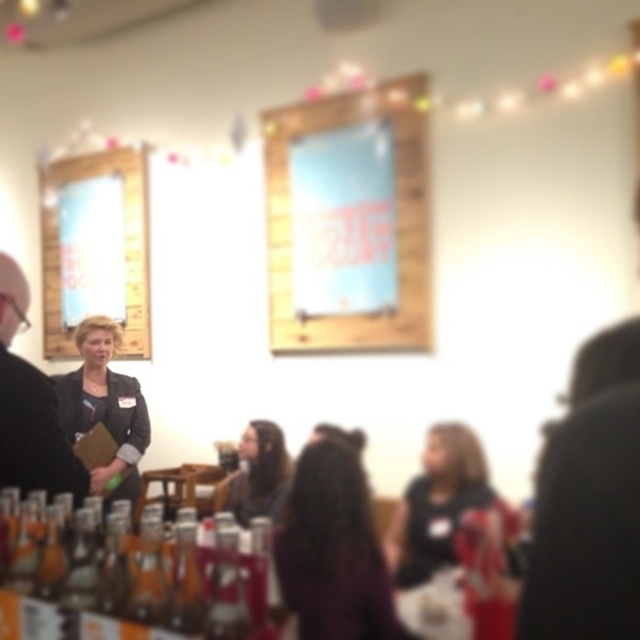
You are a photographer at the event and want to ensure both the matte black shirt at center and the long brown hair at center are fully visible in your portrait. Given their height difference, which one might require you to adjust your camera angle to avoid cropping?

The matte black shirt at center is much taller than the long brown hair at center, so you would need to adjust your camera angle to ensure the taller matte black shirt at center is fully captured without being cut off.

You are at the event and need to locate the translucent glass bottles at lower left. Where exactly are they positioned in the image?

The translucent glass bottles at lower left are positioned at point (131, 584).